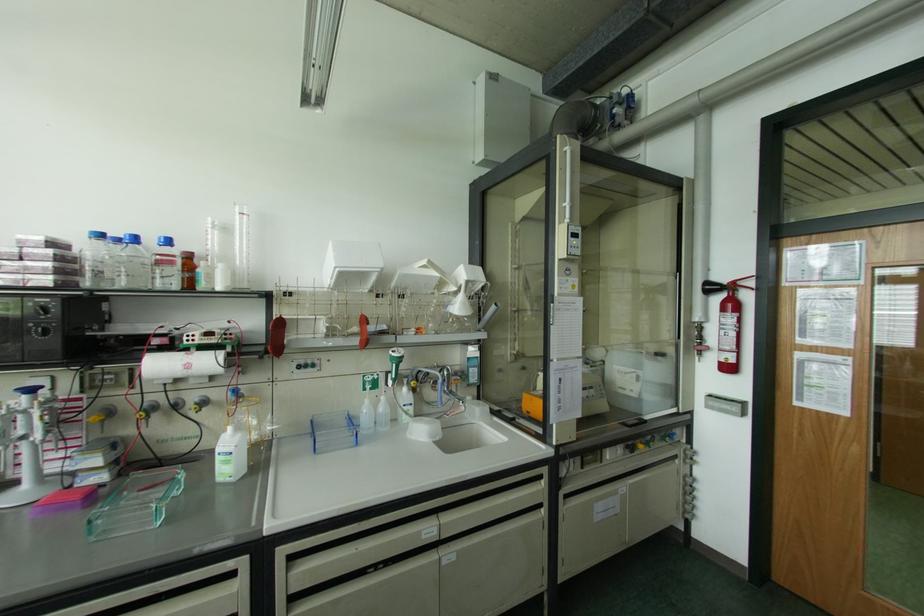
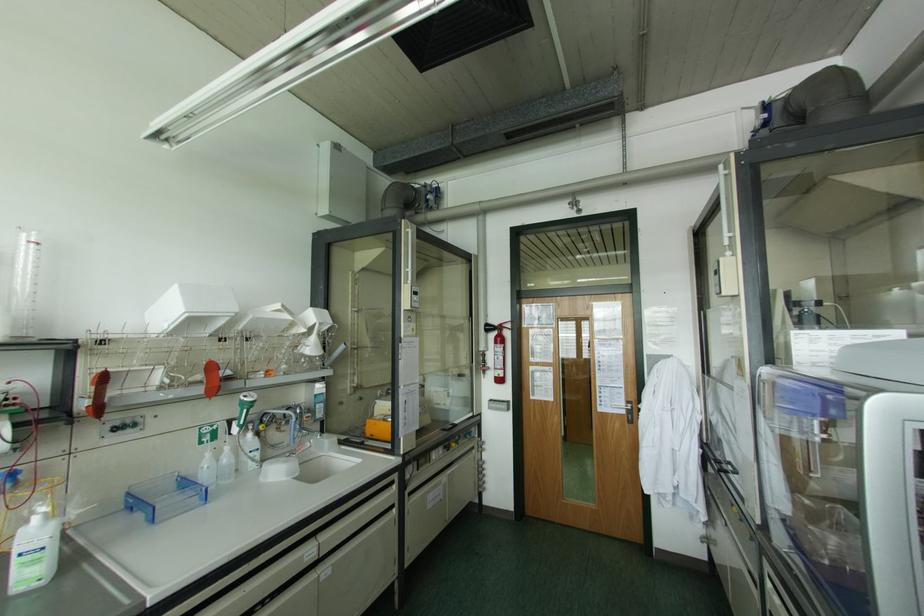
Locate, in the second image, the point that corresponds to (x=542, y=483) in the first image.

(394, 485)